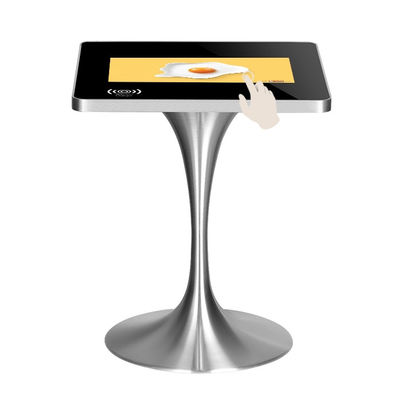
Where is `screen`? screen is located at coordinates (90, 74).